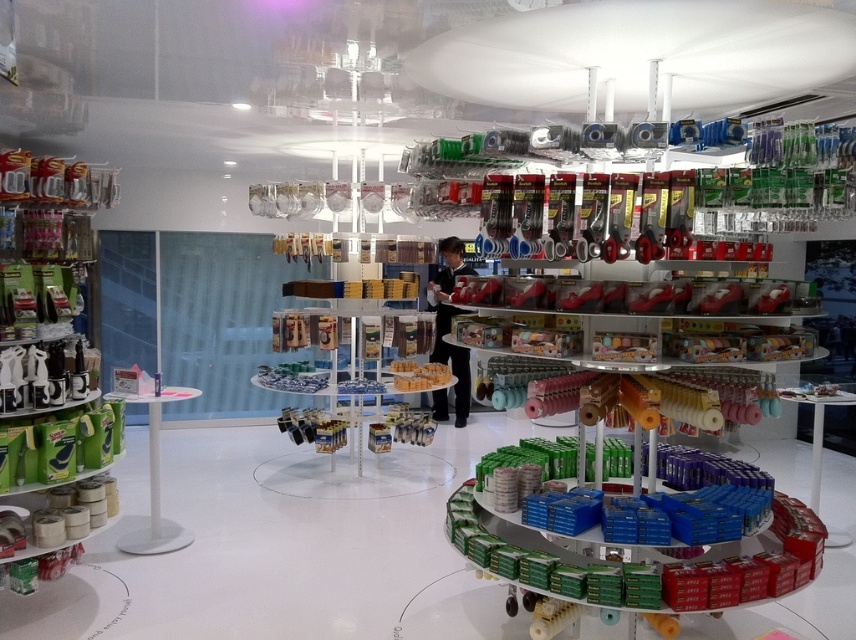
You are a customer holding a 2.5 feet wide box. You want to place it between the green matte tape at left and the clear plastic shelf at center. Is there enough space?

The distance between the green matte tape at left and the clear plastic shelf at center is 7.04 feet. Since the box is only 2.5 feet wide, there is sufficient space to place it between them.

You are organizing the store and need to place a new box of green matte tape at left on the clear plastic shelf at center. Can you directly place the tape on the shelf without moving any other items?

The green matte tape at left is already positioned to the left of the clear plastic shelf at center, so you can directly place the tape on the shelf without needing to move other items.